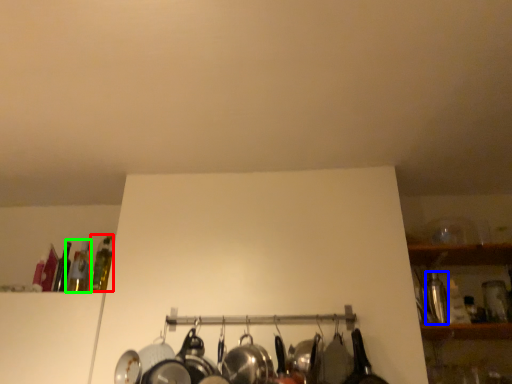
Question: Which is nearer to the bottle (highlighted by a red box)? bottle (highlighted by a blue box) or bottle (highlighted by a green box).

Choices:
 (A) bottle
 (B) bottle

Answer: (B)